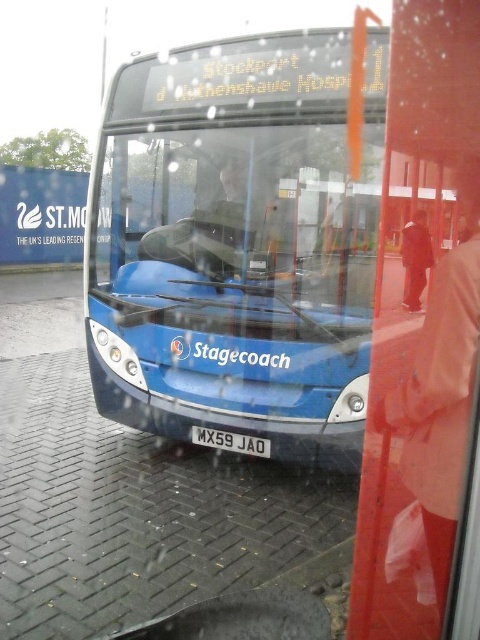
Question: Does blue metallic bus at center appear over transparent glass at center?

Choices:
 (A) no
 (B) yes

Answer: (A)

Question: Among these objects, which one is nearest to the camera?

Choices:
 (A) transparent glass at center
 (B) white plastic license plate at center

Answer: (A)

Question: Does blue metallic bus at center have a larger size compared to white plastic license plate at center?

Choices:
 (A) no
 (B) yes

Answer: (B)

Question: Is transparent glass at center behind white plastic license plate at center?

Choices:
 (A) yes
 (B) no

Answer: (B)

Question: Which of the following is the farthest from the observer?

Choices:
 (A) (155, 214)
 (B) (210, 436)

Answer: (A)

Question: Estimate the real-world distances between objects in this image. Which object is closer to the blue metallic bus at center?

Choices:
 (A) transparent glass at center
 (B) white plastic license plate at center

Answer: (A)